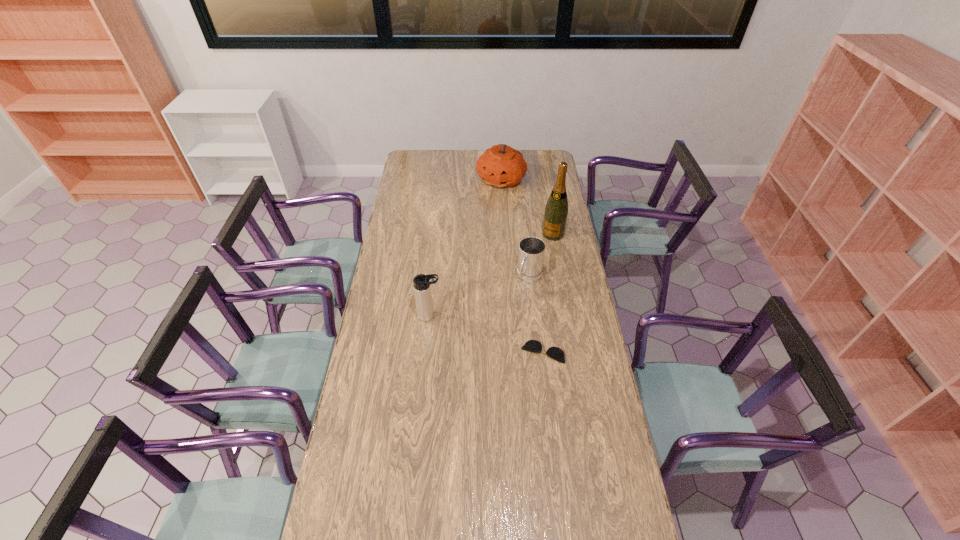
Find the location of `thermos bottle`. thermos bottle is located at coordinates (422, 290).

Where is `the leftmost object`? the leftmost object is located at coordinates (422, 290).

Image resolution: width=960 pixels, height=540 pixels. In order to click on the shortest object in this screenshot , I will do `click(555, 353)`.

At what (x,y) coordinates should I click in order to perform the action: click on spectacles. Please return your answer as a coordinate pair (x, y). The width and height of the screenshot is (960, 540). Looking at the image, I should click on pos(555,353).

Identify the location of the tallest object. The height and width of the screenshot is (540, 960). (556, 210).

This screenshot has width=960, height=540. I want to click on wine bottle, so click(x=556, y=210).

The height and width of the screenshot is (540, 960). Identify the location of the second shortest object. (531, 253).

The height and width of the screenshot is (540, 960). I want to click on the third farthest object, so click(x=531, y=253).

I want to click on the farthest object, so click(501, 166).

Locate an element on the screen. Image resolution: width=960 pixels, height=540 pixels. free space located on the handle side of the thermos bottle is located at coordinates (473, 316).